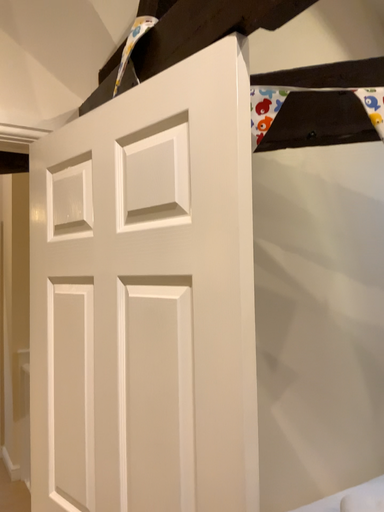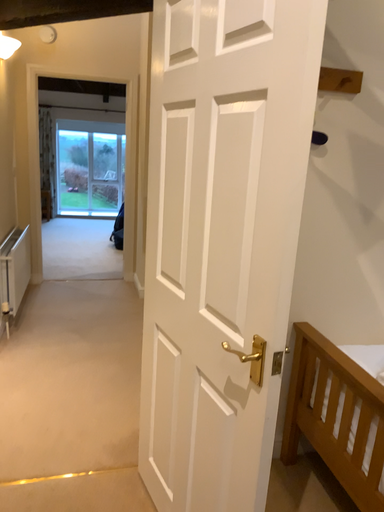
Question: Which way did the camera rotate in the video?

Choices:
 (A) rotated upward
 (B) rotated downward

Answer: (B)